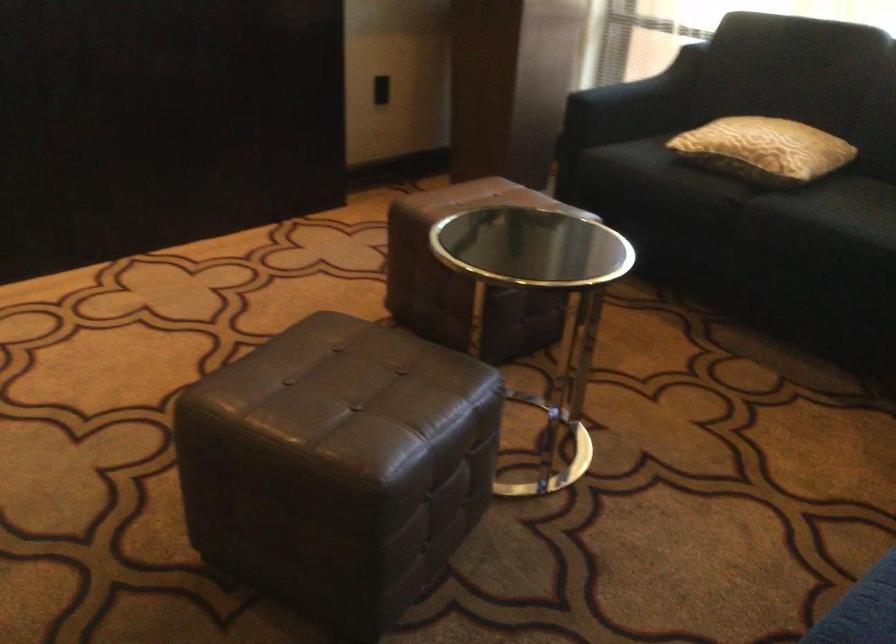
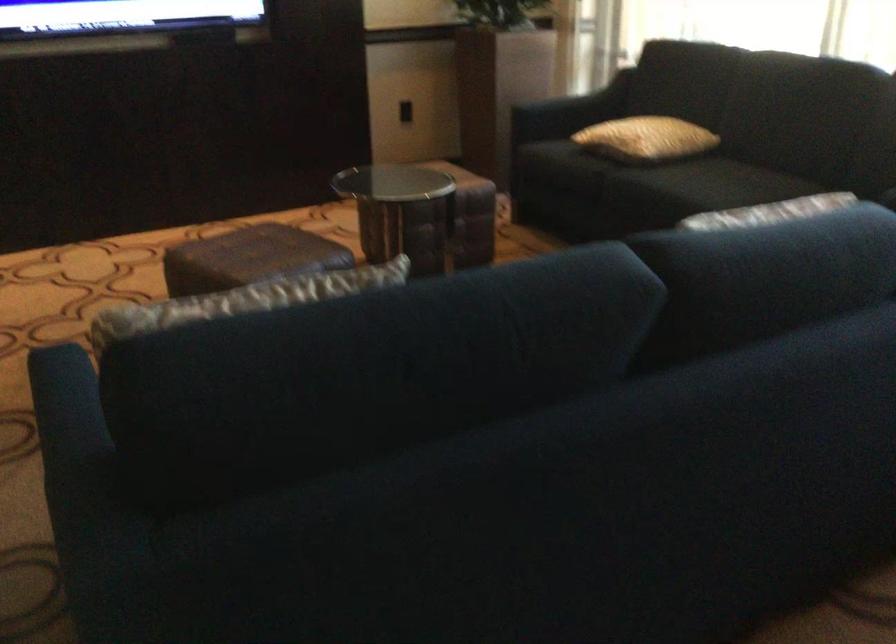
Where in the second image is the point corresponding to pixel 338 399 from the first image?

(248, 258)